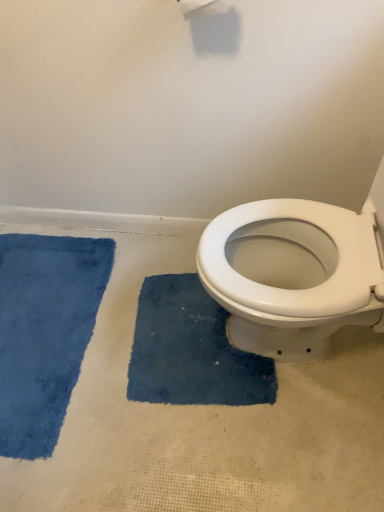
Image resolution: width=384 pixels, height=512 pixels. I want to click on free space in front of blue plush bath mat at center, the first bath mat positioned from the right, so click(x=211, y=458).